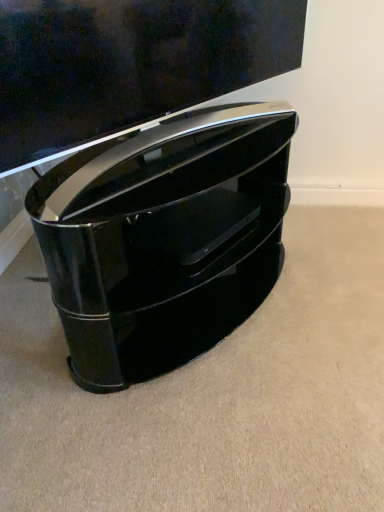
Question: Based on their positions, is glossy black tv stand at center located to the left or right of glossy black tv stand at lower center?

Choices:
 (A) right
 (B) left

Answer: (B)

Question: From a real-world perspective, is glossy black tv stand at center physically located above or below glossy black tv stand at lower center?

Choices:
 (A) above
 (B) below

Answer: (B)

Question: Considering the positions of glossy black tv stand at center and glossy black tv stand at lower center in the image, is glossy black tv stand at center taller or shorter than glossy black tv stand at lower center?

Choices:
 (A) short
 (B) tall

Answer: (B)

Question: Is point (114, 117) closer or farther from the camera than point (210, 145)?

Choices:
 (A) farther
 (B) closer

Answer: (B)

Question: From the image's perspective, is glossy black tv stand at lower center located above or below glossy black tv stand at center?

Choices:
 (A) above
 (B) below

Answer: (A)

Question: Is glossy black tv stand at lower center inside the boundaries of glossy black tv stand at center, or outside?

Choices:
 (A) inside
 (B) outside

Answer: (B)

Question: Considering the positions of glossy black tv stand at lower center and glossy black tv stand at center in the image, is glossy black tv stand at lower center wider or thinner than glossy black tv stand at center?

Choices:
 (A) thin
 (B) wide

Answer: (A)